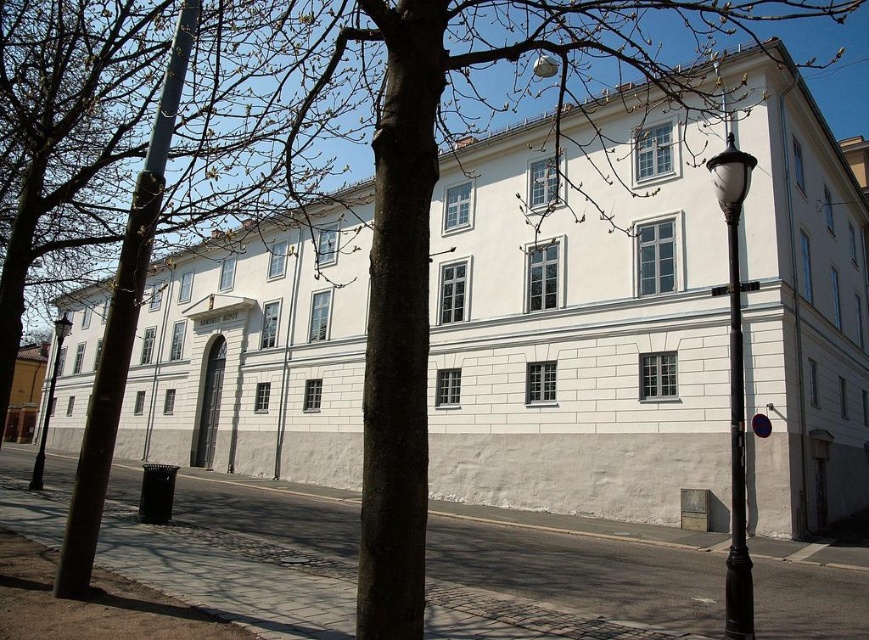
Does point (109, 330) come closer to viewer compared to point (732, 140)?

That is True.

Locate an element on the screen. Image resolution: width=869 pixels, height=640 pixels. metallic pole at left is located at coordinates (121, 326).

The image size is (869, 640). I want to click on metallic pole at left, so click(x=121, y=326).

Can you confirm if black metal lamp post at right is positioned to the right of black polished metal pole at right?

In fact, black metal lamp post at right is to the left of black polished metal pole at right.

Who is more distant from viewer, (x=724, y=611) or (x=731, y=554)?

Positioned behind is point (x=724, y=611).

Is point (735, 392) farther from camera compared to point (738, 326)?

Yes, it is.

Find the location of a particular element. Image resolution: width=869 pixels, height=640 pixels. black metal lamp post at right is located at coordinates (735, 390).

Which is more to the left, metallic pole at left or black glass lamp post at left?

Positioned to the left is black glass lamp post at left.

Where is `metallic pole at left`? The height and width of the screenshot is (640, 869). metallic pole at left is located at coordinates (121, 326).

Does point (156, 144) come farther from viewer compared to point (38, 467)?

No, (156, 144) is in front of (38, 467).

At what (x,y) coordinates should I click in order to perform the action: click on metallic pole at left. Please return your answer as a coordinate pair (x, y). This screenshot has width=869, height=640. Looking at the image, I should click on (121, 326).